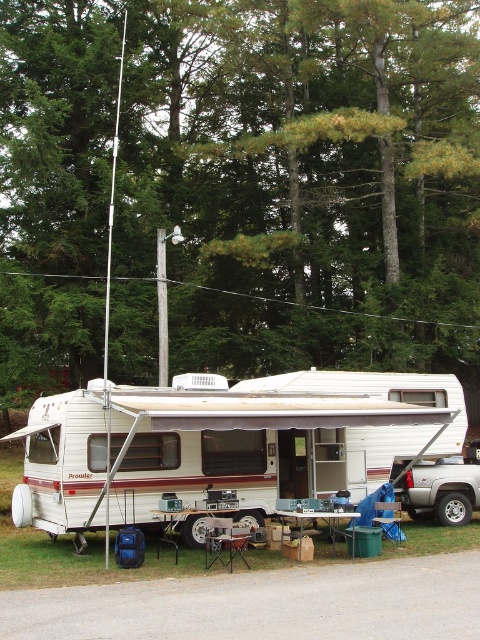
Question: From the image, what is the correct spatial relationship of green leafy tree at upper center in relation to green plastic picnic table at lower center?

Choices:
 (A) left
 (B) right

Answer: (B)

Question: Can you confirm if silver metallic truck at lower right is positioned above green plastic picnic table at lower center?

Choices:
 (A) yes
 (B) no

Answer: (B)

Question: Based on their relative distances, which object is farther from the silver metallic truck at lower right?

Choices:
 (A) white vinyl camper at center
 (B) green leafy tree at upper center
 (C) green plastic picnic table at lower center
 (D) wooden picnic table at center

Answer: (B)

Question: Which of these objects is positioned farthest from the green plastic picnic table at lower center?

Choices:
 (A) white vinyl camper at center
 (B) green leafy tree at upper center
 (C) silver metallic truck at lower right
 (D) wooden picnic table at center

Answer: (B)

Question: Does green leafy tree at upper center have a lesser width compared to green plastic picnic table at lower center?

Choices:
 (A) yes
 (B) no

Answer: (B)

Question: Estimate the real-world distances between objects in this image. Which object is closer to the green leafy tree at upper center?

Choices:
 (A) wooden picnic table at center
 (B) white vinyl camper at center

Answer: (A)